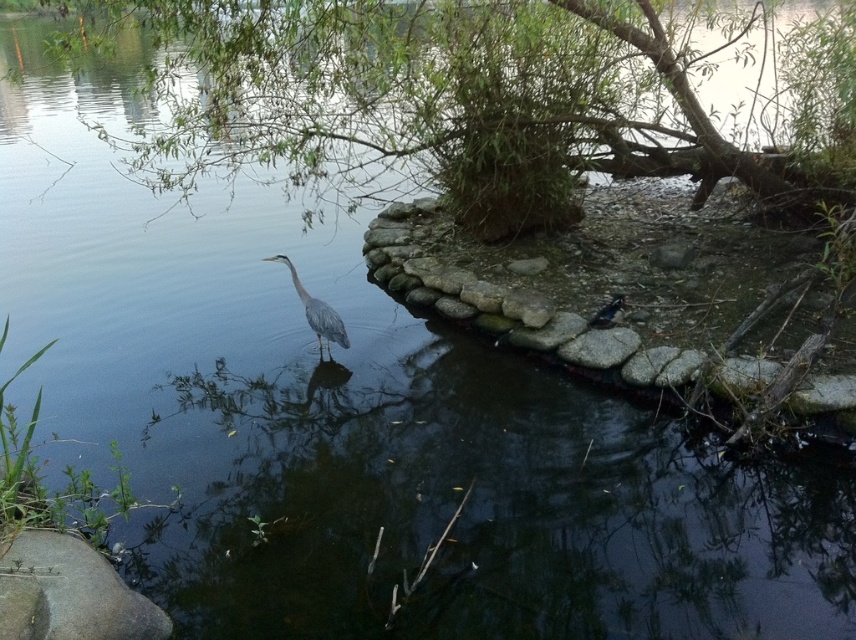
Question: Can you confirm if gray stone at lower left is smaller than gray matte bird at center?

Choices:
 (A) yes
 (B) no

Answer: (A)

Question: Which point is farther to the camera?

Choices:
 (A) green leafy tree at upper center
 (B) gray stone at lower left
 (C) gray matte bird at center
 (D) shiny black bird at center

Answer: (D)

Question: Which point is farther to the camera?

Choices:
 (A) gray stone at lower left
 (B) gray matte bird at center

Answer: (B)

Question: From the image, what is the correct spatial relationship of green leafy tree at upper center in relation to shiny black bird at center?

Choices:
 (A) below
 (B) above

Answer: (B)

Question: Based on their relative distances, which object is nearer to the gray stone at lower left?

Choices:
 (A) gray matte bird at center
 (B) shiny black bird at center

Answer: (A)

Question: Is gray stone at lower left wider than gray matte bird at center?

Choices:
 (A) yes
 (B) no

Answer: (A)